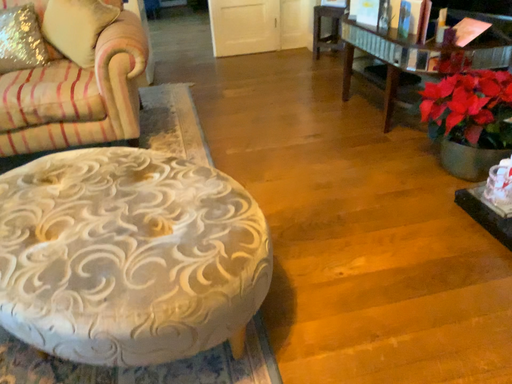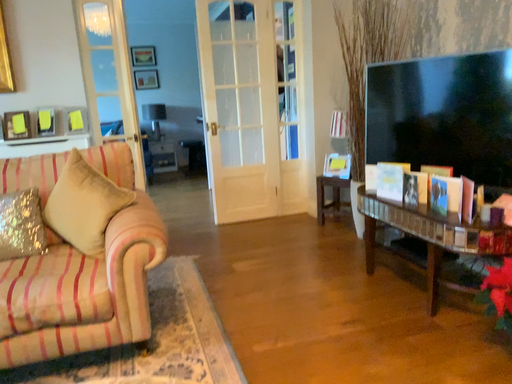
Question: How did the camera likely rotate when shooting the video?

Choices:
 (A) rotated downward
 (B) rotated upward

Answer: (B)